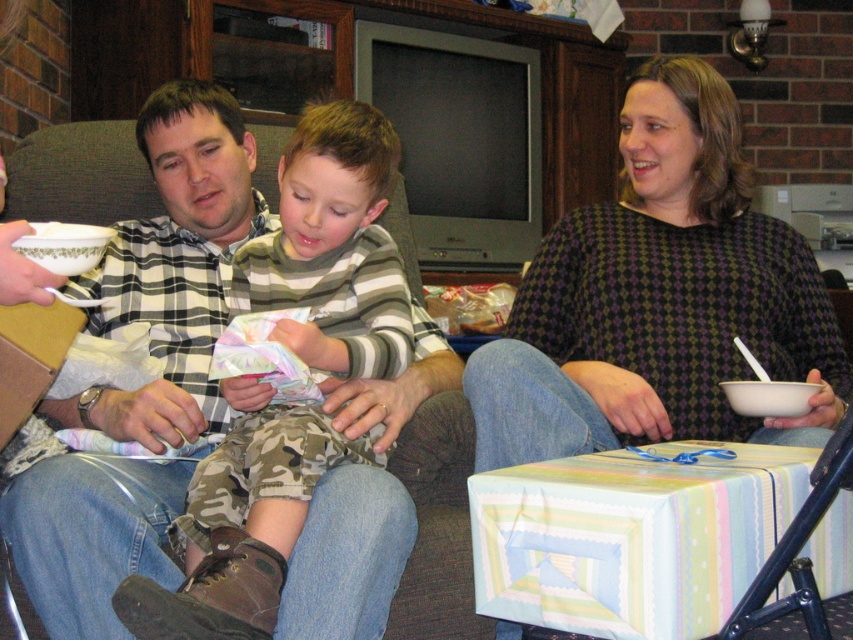
You are standing at the camera position and want to reach point (705, 81). Can you walk directly to it without moving any furniture?

The distance between you and point (705, 81) is 1.58 meters. Since there are no mentioned obstacles like furniture blocking the path in the scene description, you can walk directly to it.

You are standing in the living room and want to move from the point at coordinates point (532, 410) to the point at coordinates point (334, 365). Which direction should you move to get closer to your destination?

You should move backward because point (532, 410) is in front of point (334, 365), so moving backward will bring you closer to your destination.